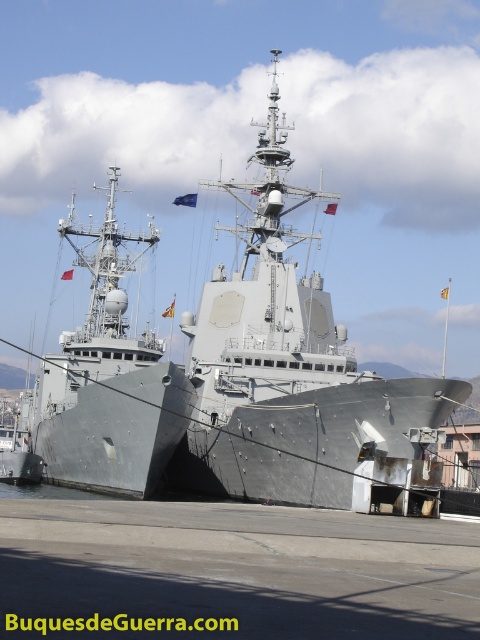
Question: Can you confirm if gray metallic ship at center is smaller than gray metallic ship at left?

Choices:
 (A) yes
 (B) no

Answer: (B)

Question: Can you confirm if gray metallic ship at center is wider than gray metallic ship at left?

Choices:
 (A) yes
 (B) no

Answer: (B)

Question: Which object is closer to the camera taking this photo?

Choices:
 (A) gray metallic ship at left
 (B) gray metallic ship at center

Answer: (B)

Question: Is gray metallic ship at center to the left of gray metallic ship at left from the viewer's perspective?

Choices:
 (A) yes
 (B) no

Answer: (B)

Question: Which of the following is the closest to the observer?

Choices:
 (A) (110, 397)
 (B) (274, 445)

Answer: (A)

Question: Which of the following is the closest to the observer?

Choices:
 (A) (255, 372)
 (B) (91, 396)

Answer: (B)